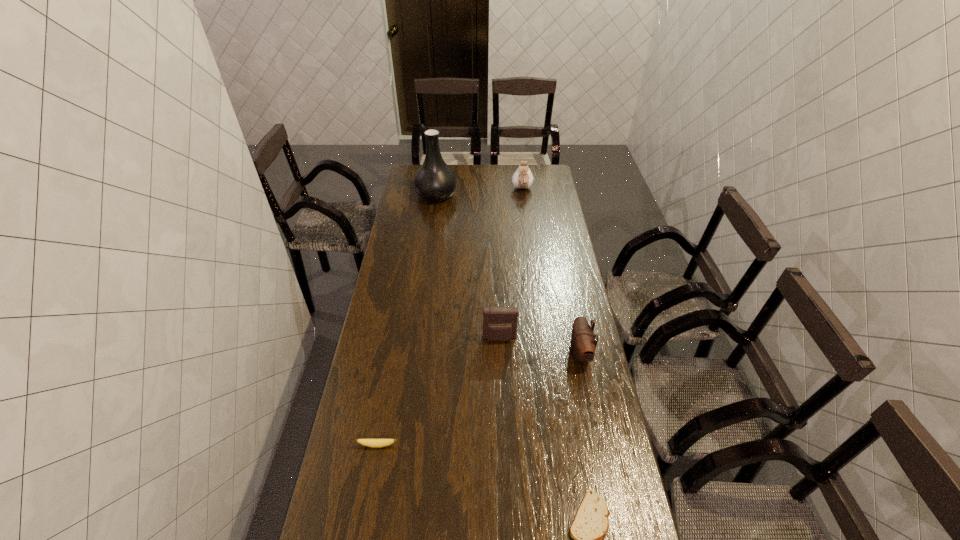
The width and height of the screenshot is (960, 540). I want to click on vase, so click(x=434, y=181).

I want to click on the farthest pouch, so click(x=522, y=178).

Locate an element on the screen. The image size is (960, 540). the leftmost pouch is located at coordinates (499, 323).

Locate an element on the screen. The height and width of the screenshot is (540, 960). the rightmost pouch is located at coordinates (583, 343).

At what (x,y) coordinates should I click in order to perform the action: click on the fifth tallest object. Please return your answer as a coordinate pair (x, y). The height and width of the screenshot is (540, 960). Looking at the image, I should click on (374, 443).

Locate an element on the screen. The height and width of the screenshot is (540, 960). banana is located at coordinates (374, 443).

Identify the location of vacant space positioned 0.060m on the left of the tallest object. (403, 195).

Where is `blank space located 0.210m on the front-facing side of the farthest pouch`? The image size is (960, 540). blank space located 0.210m on the front-facing side of the farthest pouch is located at coordinates (526, 220).

Locate an element on the screen. vacant point located 0.110m with an open flap on the leftmost pouch is located at coordinates (501, 370).

Locate an element on the screen. This screenshot has height=540, width=960. vacant area situated with the flap open on the rightmost pouch is located at coordinates (534, 354).